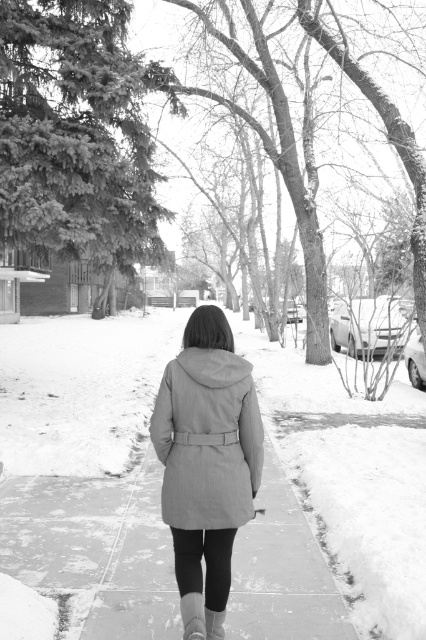
You are a fashion designer observing the winter scene. You need to determine which item of clothing is bigger between the gray wool coat at center and the gray suede boot at center. Which one is larger?

The gray wool coat at center has a larger size compared to the gray suede boot at center, so the gray wool coat at center is larger.

Looking at this image, you are standing at the camera position and want to throw a snowball to hit the point at coordinates point (221, 320). Can you estimate whether the snowball will land within 4 meters from the camera?

The distance of point (221, 320) from camera is 4.10 meters, so the snowball will land 0.10 meters beyond the 4 meter mark.